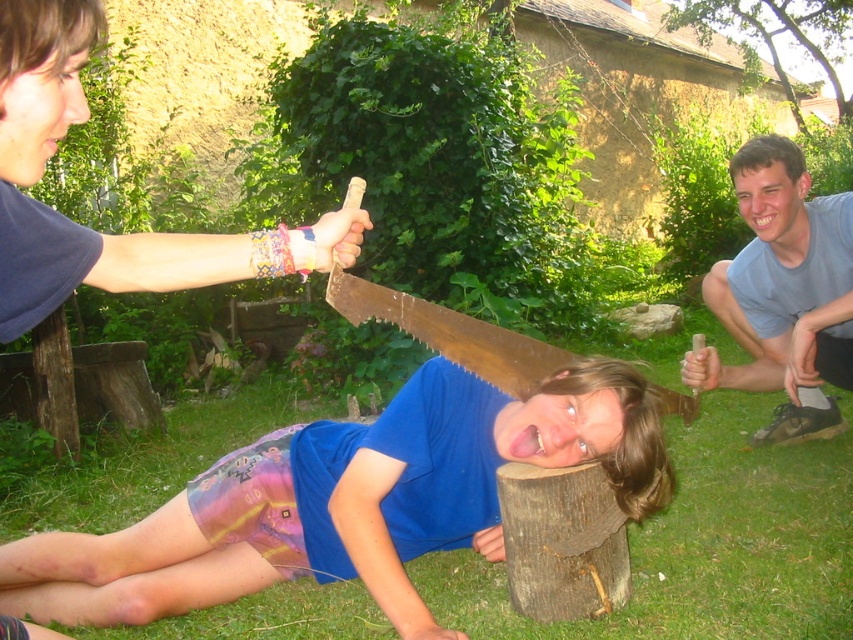
Between green grass at lower center and gray cotton shirt at lower right, which one is positioned higher?

gray cotton shirt at lower right is higher up.

Which is behind, point (450, 573) or point (746, 369)?

The point (746, 369) is behind.

Is point (726, 467) farther from camera compared to point (730, 157)?

Yes, point (726, 467) is farther from viewer.

What are the coordinates of `green grass at lower center` in the screenshot? It's located at (735, 532).